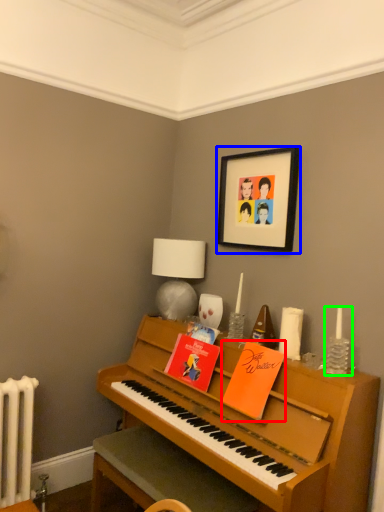
Question: Estimate the real-world distances between objects in this image. Which object is farther from book (highlighted by a red box), picture frame (highlighted by a blue box) or candle holder (highlighted by a green box)?

Choices:
 (A) picture frame
 (B) candle holder

Answer: (A)